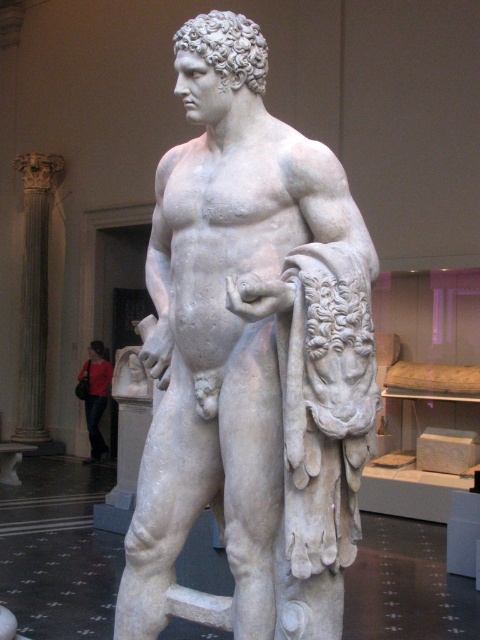
You are a visitor in the museum and want to take a photo of the white marble statue at center without the red fabric bag at lower left appearing in the frame. Is the statue taller than the bag?

The white marble statue at center has a greater height compared to the red fabric bag at lower left, so yes, the statue is taller than the bag. You can adjust your camera angle to capture the statue without the bag in the frame.

You are a visitor in a museum and want to take a photo of the white marble statue at center. However, there is a red fabric bag at lower left in the way. Can you move the bag to the side to get a clear view of the statue?

The white marble statue at center is located above the red fabric bag at lower left, so you can move the red fabric bag at lower left to the side to get a clear view of the statue.

You are standing in a museum and want to take a photo of the white marble statue at center. If you are positioned at the entrance of the museum, which is near the doorway in the background, where should you aim your camera to capture the statue in the frame?

You should aim your camera towards the center of the room, specifically at the coordinates point (251, 358), where the white marble statue at center is located.